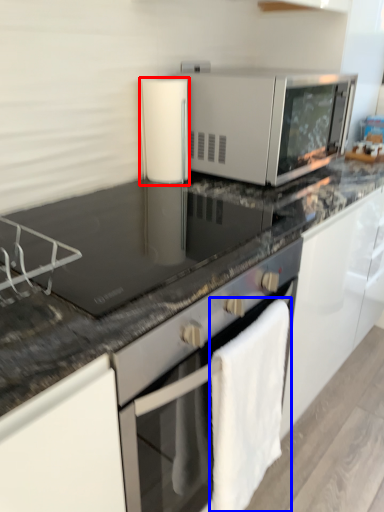
Question: Which of the following is the closest to the observer, appliance (highlighted by a red box) or bath towel (highlighted by a blue box)?

Choices:
 (A) appliance
 (B) bath towel

Answer: (B)